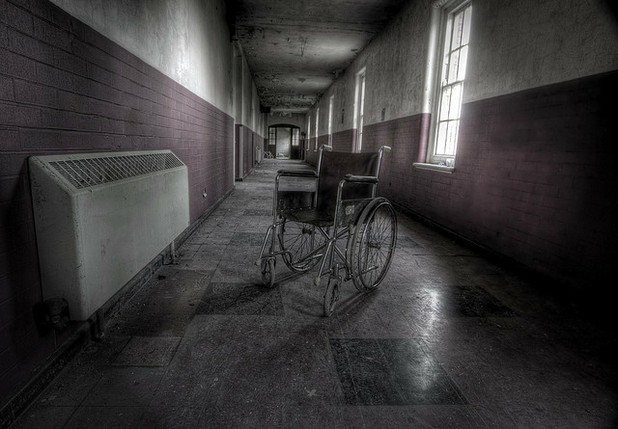
The width and height of the screenshot is (618, 429). In order to click on wheelchair seat in this screenshot , I will do `click(315, 221)`.